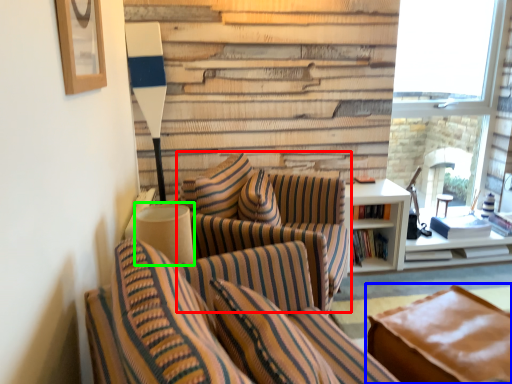
Question: Which is farther away from chair (highlighted by a red box)? studio couch (highlighted by a blue box) or table lamp (highlighted by a green box)?

Choices:
 (A) studio couch
 (B) table lamp

Answer: (A)